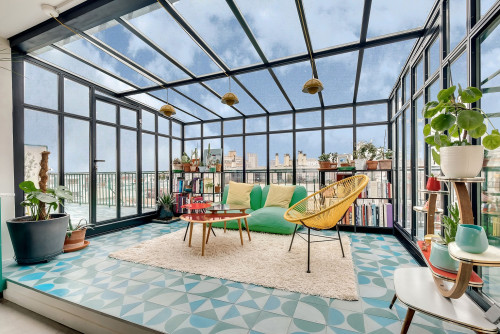
The height and width of the screenshot is (334, 500). Identify the location of wicker chair. (319, 212).